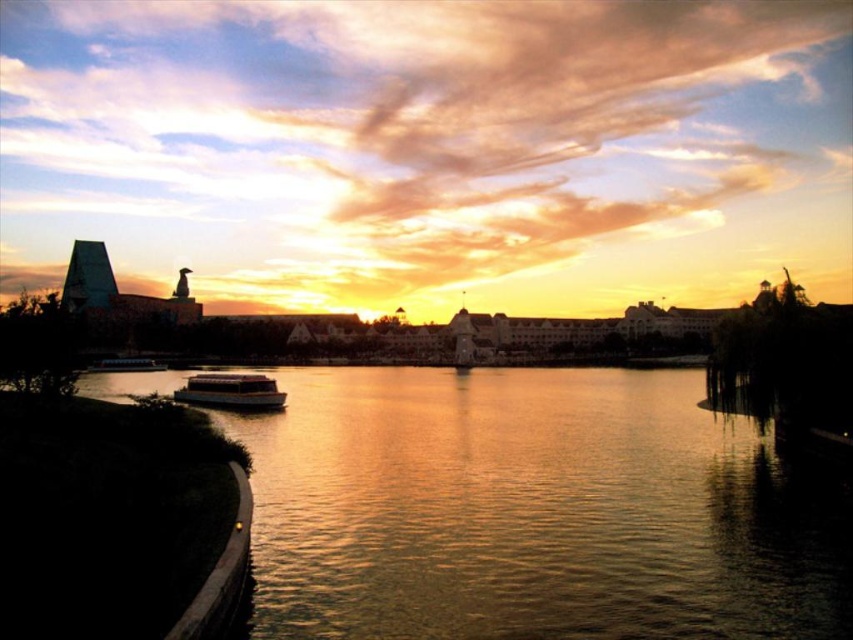
Can you confirm if metallic silver boat at center-left is thinner than white glossy boat at left?

In fact, metallic silver boat at center-left might be wider than white glossy boat at left.

Is metallic silver boat at center-left taller than white glossy boat at left?

Yes, metallic silver boat at center-left is taller than white glossy boat at left.

Find the location of a particular element. metallic silver boat at center-left is located at coordinates (231, 392).

The width and height of the screenshot is (853, 640). In order to click on metallic silver boat at center-left in this screenshot , I will do 231,392.

Is golden reflective water at center shorter than metallic silver boat at center-left?

No.

Does golden reflective water at center have a greater width compared to metallic silver boat at center-left?

Yes.

The image size is (853, 640). What are the coordinates of `golden reflective water at center` in the screenshot? It's located at (531, 512).

Which of these two, golden reflective water at center or white glossy boat at left, stands shorter?

white glossy boat at left

Is golden reflective water at center below white glossy boat at left?

Correct, golden reflective water at center is located below white glossy boat at left.

Measure the distance between point (276, 488) and camera.

A distance of 66.49 meters exists between point (276, 488) and camera.

Identify the location of golden reflective water at center. The width and height of the screenshot is (853, 640). (531, 512).